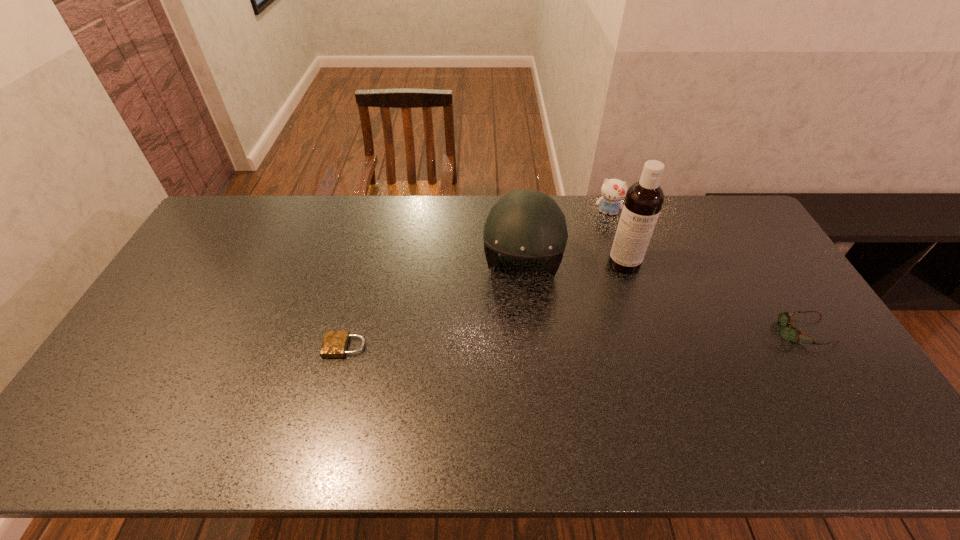
Image resolution: width=960 pixels, height=540 pixels. Find the location of `padlock`. padlock is located at coordinates (335, 343).

Identify the location of the leftmost object. This screenshot has height=540, width=960. (335, 343).

Locate an element on the screen. the fourth tallest object is located at coordinates (787, 333).

Where is `spectacles`? This screenshot has height=540, width=960. spectacles is located at coordinates (787, 333).

Where is `kitten`? Image resolution: width=960 pixels, height=540 pixels. kitten is located at coordinates (613, 191).

Locate an element on the screen. This screenshot has width=960, height=540. the third tallest object is located at coordinates (613, 191).

Locate an element on the screen. the tallest object is located at coordinates (644, 199).

The image size is (960, 540). In order to click on football helmet in this screenshot , I will do `click(526, 224)`.

Find the location of `the second object from left to right`. the second object from left to right is located at coordinates (526, 224).

Locate an element on the screen. vacant position located 0.070m on the keyhole side of the shortest object is located at coordinates (300, 346).